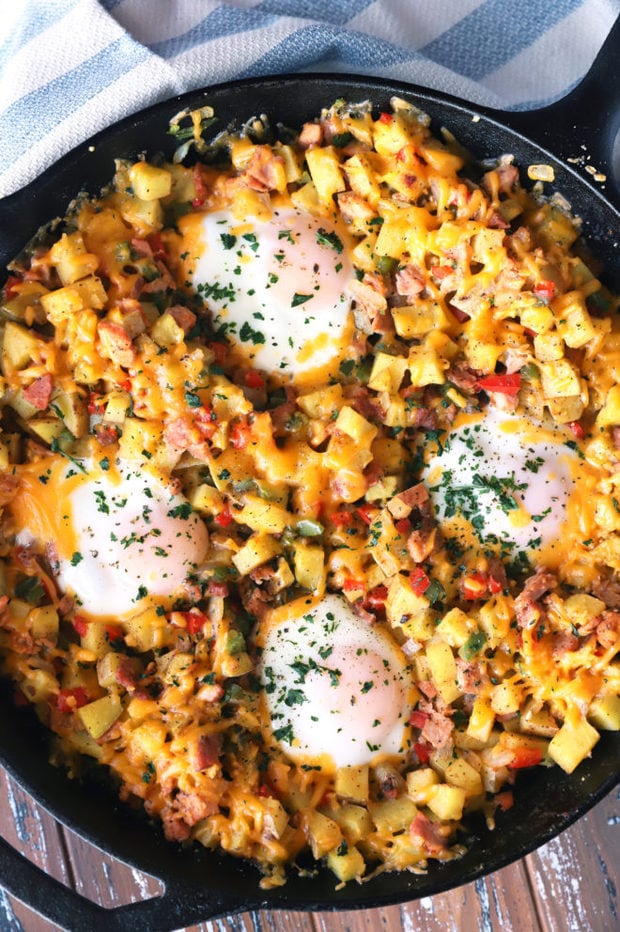
The width and height of the screenshot is (620, 932). Identify the location of right handle. (570, 120).